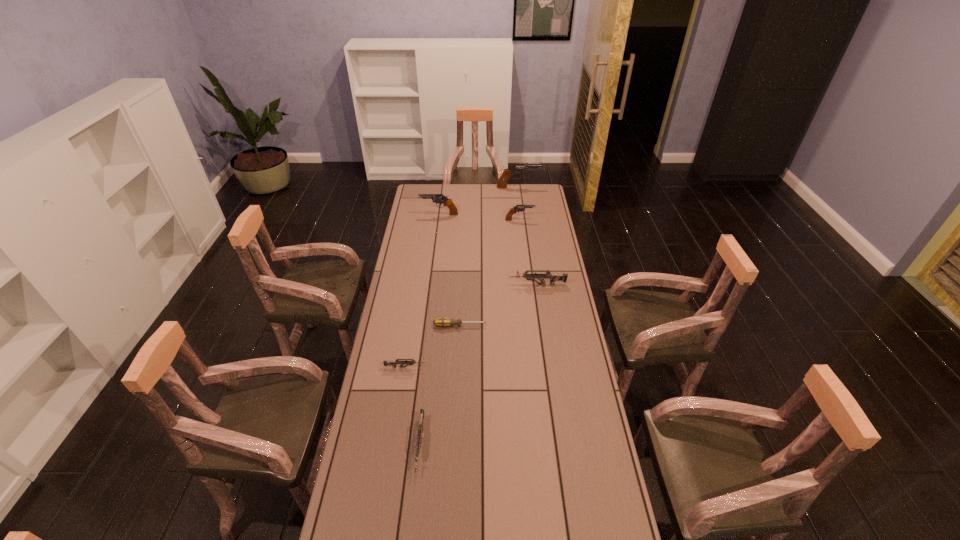
Where is `the tallest object`? This screenshot has width=960, height=540. the tallest object is located at coordinates (507, 173).

Identify the location of the tallest gun. coord(507,173).

Where is `the second smallest black gun`? the second smallest black gun is located at coordinates (439, 198).

The width and height of the screenshot is (960, 540). Find the location of `the second farthest gun`. the second farthest gun is located at coordinates (439, 198).

The height and width of the screenshot is (540, 960). Identify the location of the smallest black gun. (518, 208).

You are a GUI agent. You are given a task and a screenshot of the screen. Output one action in this format:
    pyautogui.click(x=<x>, y=<y>)
    Task: Click on the nearest black gun
    
    Given the screenshot: What is the action you would take?
    518,208

This screenshot has height=540, width=960. I want to click on the third nearest gun, so click(x=553, y=277).

Find the location of a particular element. the farthest grey gun is located at coordinates (553, 277).

At what (x,y) coordinates should I click in order to perform the action: click on the second biggest grey gun. Please return your answer as a coordinate pair (x, y). The image size is (960, 540). Looking at the image, I should click on (420, 427).

Locate an element on the screen. The height and width of the screenshot is (540, 960). the fifth tallest object is located at coordinates (420, 427).